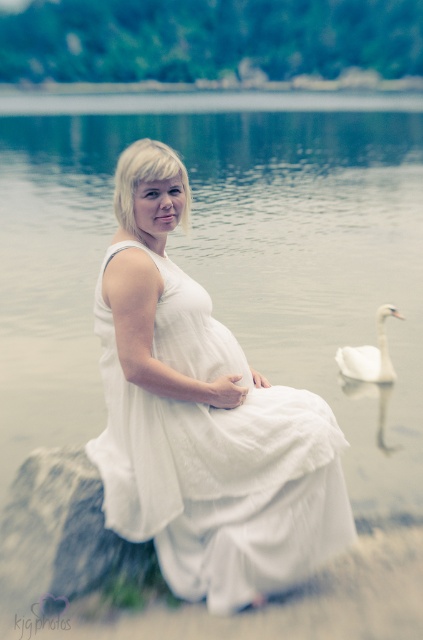
Is white linen dress at center shorter than white smooth swan at lower right?

No.

Which is more to the left, white linen dress at center or white smooth swan at lower right?

Positioned to the left is white linen dress at center.

Who is more forward, (263, 516) or (375, 358)?

Positioned in front is point (263, 516).

Find the location of a particular element. white linen dress at center is located at coordinates (216, 460).

Who is more forward, [47,116] or [274,545]?

Positioned in front is point [274,545].

Does point (60, 360) come farther from viewer compared to point (178, 536)?

Yes, it is behind point (178, 536).

Which is in front, point (406, 419) or point (118, 490)?

Point (118, 490)

You are a GUI agent. You are given a task and a screenshot of the screen. Output one action in this format:
    pyautogui.click(x=<x>, y=<y>)
    Task: Click on the clear water at center
    The width and height of the screenshot is (423, 640).
    Given the screenshot: What is the action you would take?
    pyautogui.click(x=222, y=253)

Can you confirm if clear water at center is smaller than white smooth swan at lower right?

Incorrect, clear water at center is not smaller in size than white smooth swan at lower right.

Does clear water at center have a greater width compared to white smooth swan at lower right?

Yes.

The height and width of the screenshot is (640, 423). I want to click on clear water at center, so click(222, 253).

The width and height of the screenshot is (423, 640). I want to click on clear water at center, so click(x=222, y=253).